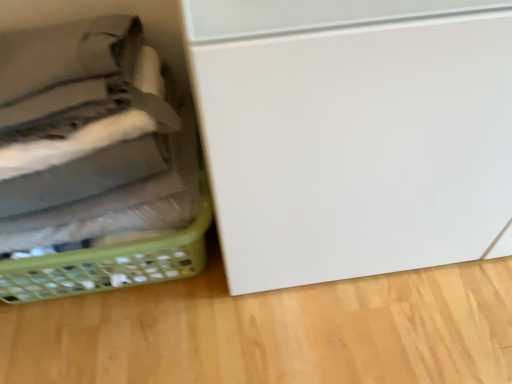
This screenshot has width=512, height=384. I want to click on green plastic basket at lower left, the 1th basket from the back, so click(x=110, y=263).

Describe the element at coordinates (110, 263) in the screenshot. I see `green plastic basket at lower left, the 1th basket from the back` at that location.

The width and height of the screenshot is (512, 384). Describe the element at coordinates (94, 161) in the screenshot. I see `green plastic basket at left, the second basket positioned from the back` at that location.

What is the approximate height of green plastic basket at left, the second basket positioned from the back?

green plastic basket at left, the second basket positioned from the back, is 34.65 centimeters tall.

In order to click on green plastic basket at left, acting as the 1th basket starting from the front in this screenshot , I will do `click(94, 161)`.

The height and width of the screenshot is (384, 512). Identify the location of green plastic basket at lower left, the 1th basket from the back. (110, 263).

Is green plastic basket at left, the second basket positioned from the back, at the right side of green plastic basket at lower left, which ranks as the second basket in front-to-back order?

Yes.

Between green plastic basket at left, acting as the 1th basket starting from the front, and green plastic basket at lower left, which ranks as the second basket in front-to-back order, which one is positioned behind?

green plastic basket at lower left, which ranks as the second basket in front-to-back order.

Considering the positions of point (140, 279) and point (165, 254), is point (140, 279) closer or farther from the camera than point (165, 254)?

Point (140, 279) is farther from the camera than point (165, 254).

From the image's perspective, does green plastic basket at left, acting as the 1th basket starting from the front, appear lower than green plastic basket at lower left, the 1th basket from the back?

Incorrect, from the image's perspective, green plastic basket at left, acting as the 1th basket starting from the front, is higher than green plastic basket at lower left, the 1th basket from the back.

From a real-world perspective, does green plastic basket at left, acting as the 1th basket starting from the front, stand above green plastic basket at lower left, which ranks as the second basket in front-to-back order?

Correct, in the physical world, green plastic basket at left, acting as the 1th basket starting from the front, is higher than green plastic basket at lower left, which ranks as the second basket in front-to-back order.

Between green plastic basket at left, the second basket positioned from the back, and green plastic basket at lower left, the 1th basket from the back, which one has larger width?

green plastic basket at lower left, the 1th basket from the back, is wider.

Which of these two, green plastic basket at left, acting as the 1th basket starting from the front, or green plastic basket at lower left, the 1th basket from the back, stands taller?

With more height is green plastic basket at left, acting as the 1th basket starting from the front.

Can you confirm if green plastic basket at left, the second basket positioned from the back, is smaller than green plastic basket at lower left, which ranks as the second basket in front-to-back order?

No.

Can green plastic basket at lower left, which ranks as the second basket in front-to-back order, be found inside green plastic basket at left, the second basket positioned from the back?

No, green plastic basket at left, the second basket positioned from the back, does not contain green plastic basket at lower left, which ranks as the second basket in front-to-back order.

Is green plastic basket at left, the second basket positioned from the back, far away from green plastic basket at lower left, the 1th basket from the back?

They are positioned close to each other.

Is green plastic basket at left, acting as the 1th basket starting from the front, facing towards green plastic basket at lower left, which ranks as the second basket in front-to-back order?

No, green plastic basket at left, acting as the 1th basket starting from the front, is not facing towards green plastic basket at lower left, which ranks as the second basket in front-to-back order.

How many degrees apart are the facing directions of green plastic basket at left, the second basket positioned from the back, and green plastic basket at lower left, the 1th basket from the back?

9.05e-05 degrees.

At what (x,y) coordinates should I click in order to perform the action: click on basket above the green plastic basket at lower left, which ranks as the second basket in front-to-back order (from a real-world perspective). Please return your answer as a coordinate pair (x, y). Looking at the image, I should click on (94, 161).

Based on their positions, is green plastic basket at lower left, the 1th basket from the back, located to the left or right of green plastic basket at left, acting as the 1th basket starting from the front?

green plastic basket at lower left, the 1th basket from the back, is positioned on green plastic basket at left, acting as the 1th basket starting from the front,'s left side.

Considering the positions of objects green plastic basket at lower left, the 1th basket from the back, and green plastic basket at left, the second basket positioned from the back, in the image provided, who is behind, green plastic basket at lower left, the 1th basket from the back, or green plastic basket at left, the second basket positioned from the back,?

green plastic basket at lower left, the 1th basket from the back.

Considering the positions of point (78, 273) and point (117, 90), is point (78, 273) closer or farther from the camera than point (117, 90)?

Point (78, 273) is positioned farther from the camera compared to point (117, 90).

From the image's perspective, is green plastic basket at lower left, which ranks as the second basket in front-to-back order, under green plastic basket at left, acting as the 1th basket starting from the front?

Yes.

From a real-world perspective, relative to green plastic basket at left, the second basket positioned from the back, is green plastic basket at lower left, the 1th basket from the back, vertically above or below?

green plastic basket at lower left, the 1th basket from the back, is situated lower than green plastic basket at left, the second basket positioned from the back, in the real world.

Between green plastic basket at lower left, the 1th basket from the back, and green plastic basket at left, the second basket positioned from the back, which one has smaller width?

green plastic basket at left, the second basket positioned from the back.

Which of these two, green plastic basket at lower left, which ranks as the second basket in front-to-back order, or green plastic basket at left, the second basket positioned from the back, stands taller?

Standing taller between the two is green plastic basket at left, the second basket positioned from the back.

Consider the image. Which of these two, green plastic basket at lower left, which ranks as the second basket in front-to-back order, or green plastic basket at left, acting as the 1th basket starting from the front, is bigger?

With larger size is green plastic basket at left, acting as the 1th basket starting from the front.

In the scene shown: Which is correct: green plastic basket at lower left, which ranks as the second basket in front-to-back order, is inside green plastic basket at left, the second basket positioned from the back, or outside of it?

The correct answer is: outside.

Is there a large distance between green plastic basket at lower left, the 1th basket from the back, and green plastic basket at left, acting as the 1th basket starting from the front?

No, green plastic basket at lower left, the 1th basket from the back, is not far away from green plastic basket at left, acting as the 1th basket starting from the front.

Based on the photo, could you tell me if green plastic basket at lower left, the 1th basket from the back, is turned towards green plastic basket at left, acting as the 1th basket starting from the front?

No.

How different are the orientations of green plastic basket at lower left, the 1th basket from the back, and green plastic basket at left, the second basket positioned from the back, in degrees?

9.05e-05 degrees.

Measure the distance between green plastic basket at lower left, the 1th basket from the back, and green plastic basket at left, acting as the 1th basket starting from the front.

green plastic basket at lower left, the 1th basket from the back, and green plastic basket at left, acting as the 1th basket starting from the front, are 9.30 centimeters apart from each other.

Image resolution: width=512 pixels, height=384 pixels. I want to click on basket in front of the green plastic basket at lower left, which ranks as the second basket in front-to-back order, so click(x=94, y=161).

Where is `basket below the green plastic basket at left, the second basket positioned from the back (from the image's perspective)`? The height and width of the screenshot is (384, 512). basket below the green plastic basket at left, the second basket positioned from the back (from the image's perspective) is located at coordinates (110, 263).

The width and height of the screenshot is (512, 384). Identify the location of basket on the left of green plastic basket at left, the second basket positioned from the back. (110, 263).